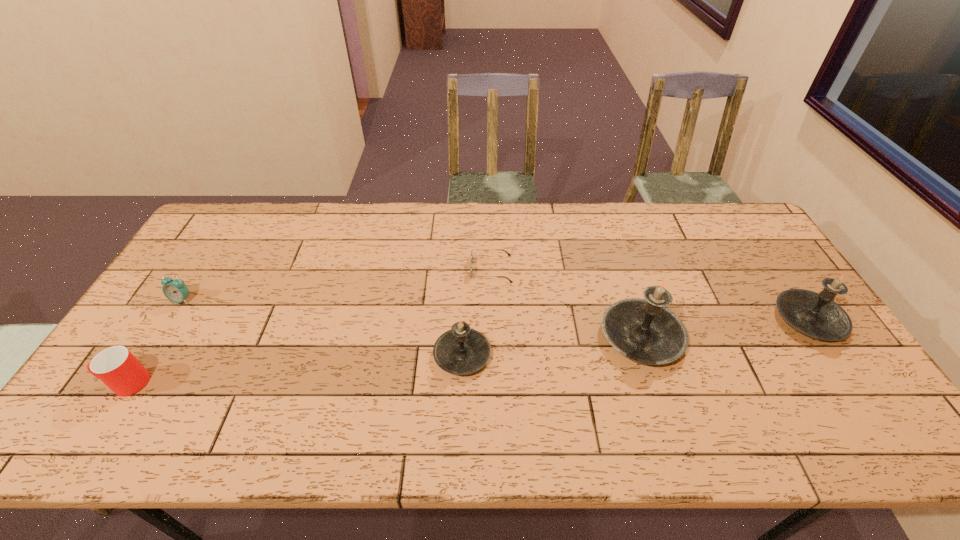
At what (x,y) coordinates should I click in order to perform the action: click on vacant space located on the right of the leftmost candle. Please return your answer as a coordinate pair (x, y). This screenshot has width=960, height=540. Looking at the image, I should click on (586, 355).

Locate an element on the screen. The width and height of the screenshot is (960, 540). vacant space situated on the left of the tallest candle is located at coordinates (465, 336).

Where is `vacant space located 0.350m on the left of the second tallest candle`? This screenshot has width=960, height=540. vacant space located 0.350m on the left of the second tallest candle is located at coordinates (652, 319).

I want to click on free location located on the front-facing side of the farthest object, so click(x=385, y=269).

Image resolution: width=960 pixels, height=540 pixels. Find the location of `vacant space located on the front-facing side of the farthest object`. vacant space located on the front-facing side of the farthest object is located at coordinates (411, 269).

Image resolution: width=960 pixels, height=540 pixels. In order to click on free space located 0.320m on the front-facing side of the farthest object in this screenshot , I will do `click(370, 269)`.

At what (x,y) coordinates should I click in order to perform the action: click on vacant space located on the face of the alarm clock. Please return your answer as a coordinate pair (x, y). This screenshot has height=540, width=960. Looking at the image, I should click on (154, 345).

What are the coordinates of `candle present at the near edge` in the screenshot? It's located at (460, 351).

In order to click on cup present at the near edge in this screenshot , I will do `click(116, 367)`.

Identify the location of alarm clock that is at the left edge. Image resolution: width=960 pixels, height=540 pixels. (175, 290).